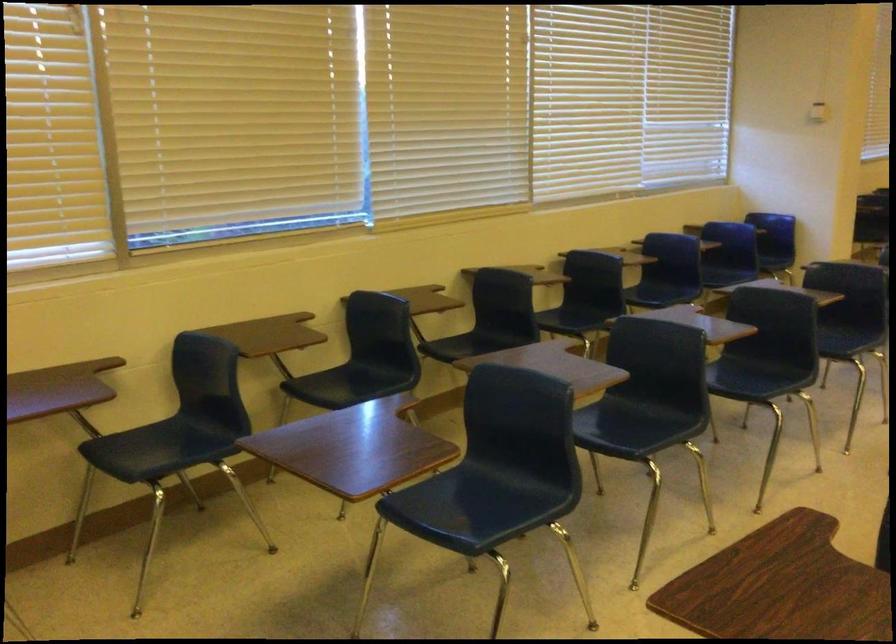
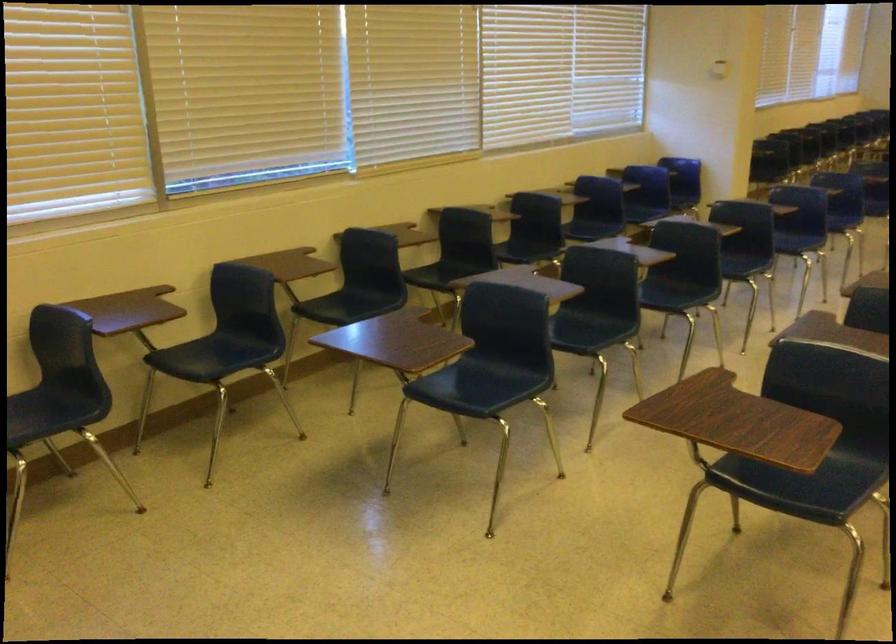
Where in the second image is the point corresponding to [143,451] from the first image?

(196, 359)